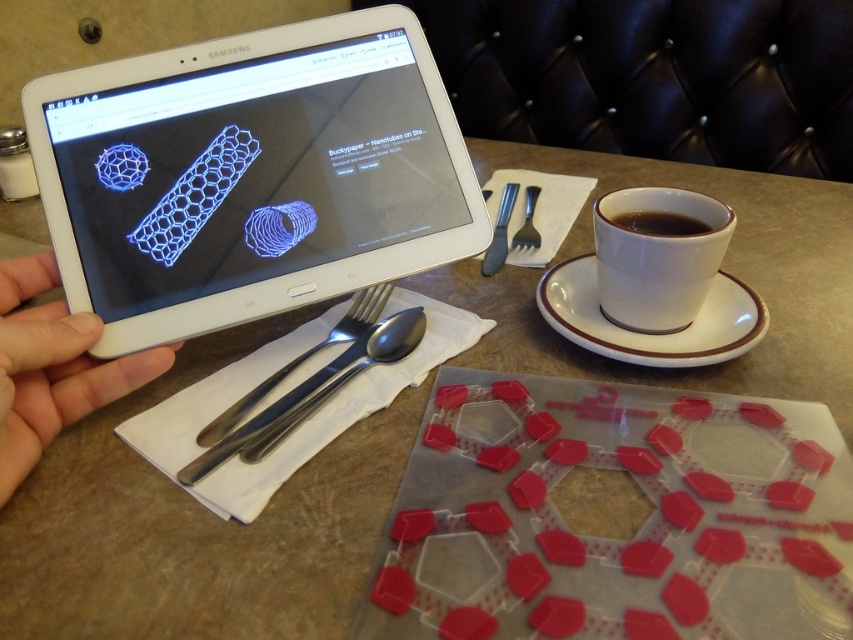
Question: Is the position of white ceramic saucer at right less distant than that of silver metallic spoon at center?

Choices:
 (A) yes
 (B) no

Answer: (B)

Question: Can you confirm if black ceramic cup at right is positioned above satin silver fork at upper center?

Choices:
 (A) yes
 (B) no

Answer: (B)

Question: Is silver metallic spoon at center to the left of black ceramic cup at right from the viewer's perspective?

Choices:
 (A) yes
 (B) no

Answer: (A)

Question: Which of these objects is positioned farthest from the white ceramic saucer at right?

Choices:
 (A) silvermetallicfork at right
 (B) white plastic tablet at upper left

Answer: (B)

Question: Based on their relative distances, which object is nearer to the silver metallic spoon at center?

Choices:
 (A) satin silver fork at upper center
 (B) silvermetallicfork at right

Answer: (B)

Question: Which point appears closest to the camera in this image?

Choices:
 (A) (27, 314)
 (B) (680, 221)
 (C) (524, 230)
 (D) (494, 250)

Answer: (A)